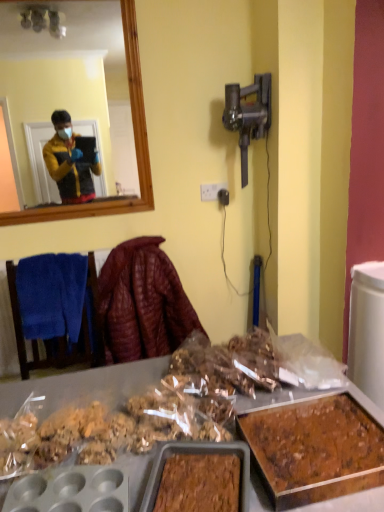
Where is `white plastic power outlet at center`? The height and width of the screenshot is (512, 384). white plastic power outlet at center is located at coordinates (211, 191).

Consider the image. From the image's perspective, is blue towel at left above or below brown crumbly cake at lower right?

From the image's perspective, blue towel at left appears above brown crumbly cake at lower right.

Does blue towel at left have a greater height compared to brown crumbly cake at lower right?

Indeed, blue towel at left has a greater height compared to brown crumbly cake at lower right.

Is blue towel at left turned away from brown crumbly cake at lower right?

blue towel at left does not have its back to brown crumbly cake at lower right.

Can you confirm if leather-like maroon jacket at center is positioned to the left of blue towel at left?

No.

What's the angular difference between leather-like maroon jacket at center and blue towel at left's facing directions?

There is a 0.00284-degree angle between the facing directions of leather-like maroon jacket at center and blue towel at left.

Where is `blanket below the blue towel at left (from a real-world perspective)`? Image resolution: width=384 pixels, height=512 pixels. blanket below the blue towel at left (from a real-world perspective) is located at coordinates (142, 303).

Considering the sizes of blue towel at left and leather-like maroon jacket at center in the image, is blue towel at left taller or shorter than leather-like maroon jacket at center?

Clearly, blue towel at left is shorter compared to leather-like maroon jacket at center.

Is blue towel at left looking in the opposite direction of leather-like maroon jacket at center?

No, blue towel at left is not facing away from leather-like maroon jacket at center.

Which object is positioned more to the right, blue towel at left or leather-like maroon jacket at center?

Positioned to the right is leather-like maroon jacket at center.

Visually, is blue towel at left positioned to the left or to the right of white plastic power outlet at center?

blue towel at left is positioned on white plastic power outlet at center's left side.

Considering the sizes of objects blue towel at left and white plastic power outlet at center in the image provided, who is thinner, blue towel at left or white plastic power outlet at center?

white plastic power outlet at center is thinner.

Is blue towel at left not near white plastic power outlet at center?

No, blue towel at left is not far from white plastic power outlet at center.

Is blue towel at left facing towards white plastic power outlet at center?

No.

Considering the positions of points (318, 399) and (22, 263), is point (318, 399) closer to camera compared to point (22, 263)?

Yes, point (318, 399) is closer to viewer.

Is brown crumbly cake at lower right completely or partially outside of blue towel at left?

Yes.

Is brown crumbly cake at lower right directly adjacent to blue towel at left?

No, brown crumbly cake at lower right is not making contact with blue towel at left.

Measure the distance from brown crumbly cake at lower right to blue towel at left.

A distance of 1.22 meters exists between brown crumbly cake at lower right and blue towel at left.

Does white plastic power outlet at center have a greater height compared to leather-like maroon jacket at center?

No, white plastic power outlet at center is not taller than leather-like maroon jacket at center.

This screenshot has height=512, width=384. In order to click on power outlet that appears above the leather-like maroon jacket at center (from a real-world perspective) in this screenshot , I will do `click(211, 191)`.

Who is bigger, white plastic power outlet at center or leather-like maroon jacket at center?

leather-like maroon jacket at center.

From the image's perspective, relative to leather-like maroon jacket at center, is white plastic power outlet at center above or below?

Based on their image positions, white plastic power outlet at center is located above leather-like maroon jacket at center.

From a real-world perspective, between white plastic power outlet at center and blue towel at left, who is vertically lower?

blue towel at left, from a real-world perspective.

From the picture: Is white plastic power outlet at center at the right side of blue towel at left?

Correct, you'll find white plastic power outlet at center to the right of blue towel at left.

Is white plastic power outlet at center aimed at blue towel at left?

No, white plastic power outlet at center is not aimed at blue towel at left.

Find the location of `furniture lying on the left of brown crumbly cake at lower right`. furniture lying on the left of brown crumbly cake at lower right is located at coordinates (55, 309).

Image resolution: width=384 pixels, height=512 pixels. I want to click on furniture in front of the leather-like maroon jacket at center, so click(x=55, y=309).

Which object lies further to the anchor point brown crumbly cake at lower right, leather-like maroon jacket at center or white plastic power outlet at center?

white plastic power outlet at center is positioned further to the anchor brown crumbly cake at lower right.

When comparing their distances from leather-like maroon jacket at center, does brown crumbly cake at lower right or blue towel at left seem further?

Among the two, brown crumbly cake at lower right is located further to leather-like maroon jacket at center.

Considering their positions, is white plastic power outlet at center positioned further to blue towel at left than leather-like maroon jacket at center?

Among the two, white plastic power outlet at center is located further to blue towel at left.

From the picture: When comparing their distances from white plastic power outlet at center, does blue towel at left or leather-like maroon jacket at center seem further?

blue towel at left lies further to white plastic power outlet at center than the other object.

Considering their positions, is blue towel at left positioned closer to leather-like maroon jacket at center than brown crumbly cake at lower right?

blue towel at left lies closer to leather-like maroon jacket at center than the other object.

Which object lies further to the anchor point brown crumbly cake at lower right, leather-like maroon jacket at center or blue towel at left?

The object further to brown crumbly cake at lower right is blue towel at left.

Considering their positions, is white plastic power outlet at center positioned closer to blue towel at left than brown crumbly cake at lower right?

Based on the image, white plastic power outlet at center appears to be nearer to blue towel at left.

When comparing their distances from blue towel at left, does leather-like maroon jacket at center or brown crumbly cake at lower right seem closer?

leather-like maroon jacket at center is positioned closer to the anchor blue towel at left.

Identify the location of furniture located between brown crumbly cake at lower right and leather-like maroon jacket at center in the depth direction. Image resolution: width=384 pixels, height=512 pixels. (55, 309).

The width and height of the screenshot is (384, 512). Identify the location of blanket located between brown crumbly cake at lower right and white plastic power outlet at center in the depth direction. (142, 303).

At what (x,y) coordinates should I click in order to perform the action: click on furniture between brown crumbly cake at lower right and white plastic power outlet at center from front to back. Please return your answer as a coordinate pair (x, y). Looking at the image, I should click on (55, 309).

What are the coordinates of `blanket between blue towel at left and white plastic power outlet at center` in the screenshot? It's located at (142, 303).